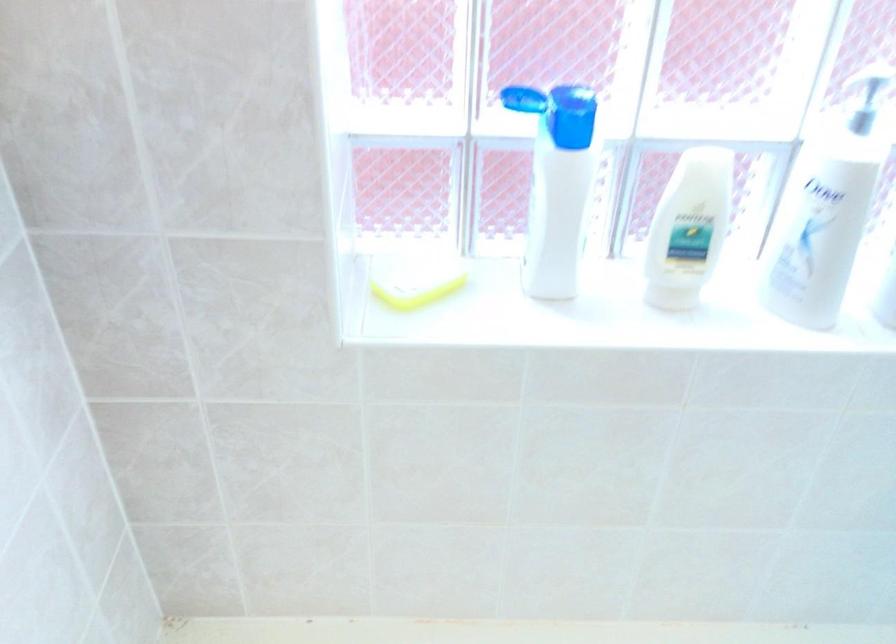
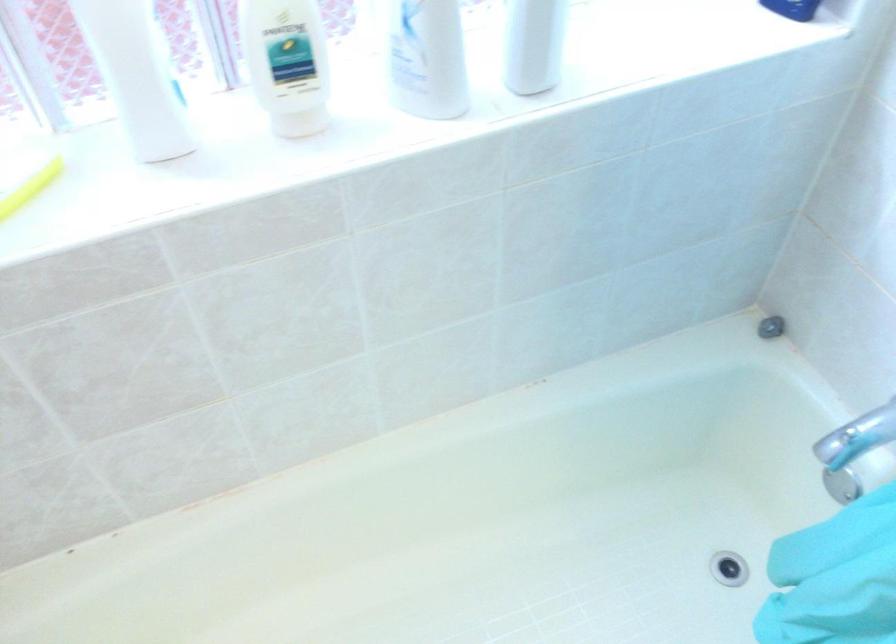
In a continuous first-person perspective shot, in which direction is the camera moving?

The cameraman walked toward right, forward.